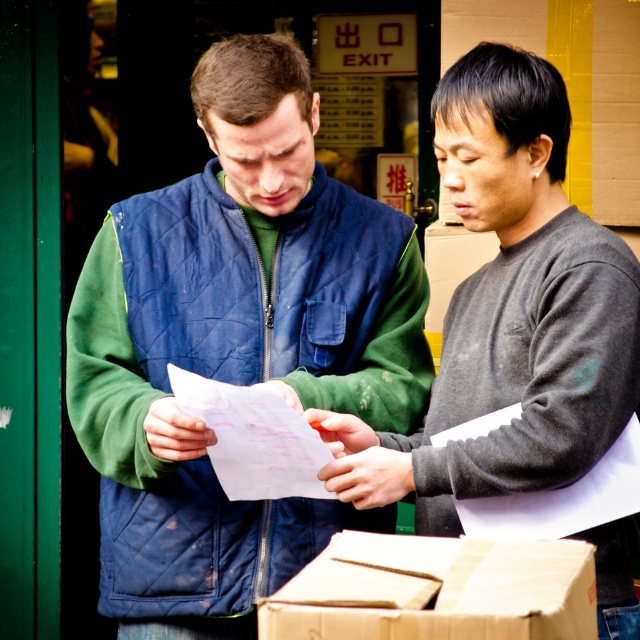
Question: Which of the following is the closest to the observer?

Choices:
 (A) (428, 561)
 (B) (292, 552)
 (C) (547, 392)
 (D) (184, 401)

Answer: (A)

Question: Which of the following is the farthest from the observer?

Choices:
 (A) gray matte sweater at center
 (B) white paper at center
 (C) blue quilted vest at center
 (D) brown cardboard box at lower center

Answer: (C)

Question: Is brown cardboard box at lower center bigger than white paper at center?

Choices:
 (A) no
 (B) yes

Answer: (A)

Question: Is gray matte sweater at center positioned at the back of white paper at center?

Choices:
 (A) yes
 (B) no

Answer: (B)

Question: Is brown cardboard box at lower center wider than white paper at center?

Choices:
 (A) no
 (B) yes

Answer: (B)

Question: Which point is closer to the camera taking this photo?

Choices:
 (A) pyautogui.click(x=314, y=460)
 (B) pyautogui.click(x=211, y=337)

Answer: (A)